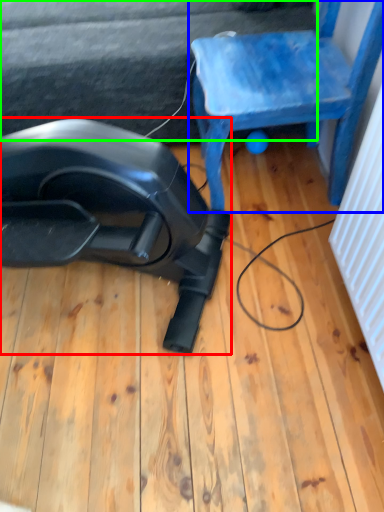
Question: Which is farther away from equipment (highlighted by a red box)? chair (highlighted by a blue box) or surface (highlighted by a green box)?

Choices:
 (A) chair
 (B) surface

Answer: (B)